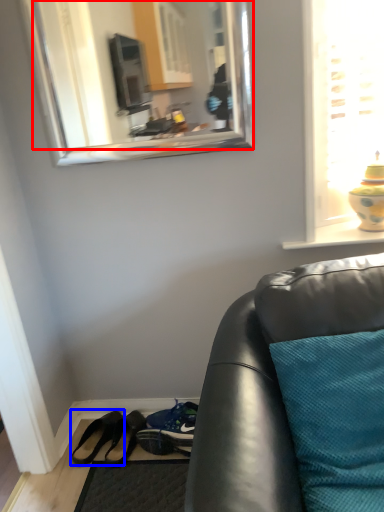
Question: Which point is further to the camera, mirror (highlighted by a red box) or footwear (highlighted by a blue box)?

Choices:
 (A) mirror
 (B) footwear

Answer: (B)